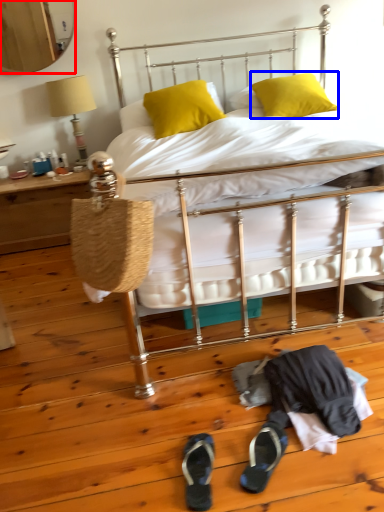
Question: Which object appears farthest to the camera in this image, mirror (highlighted by a red box) or pillow (highlighted by a blue box)?

Choices:
 (A) mirror
 (B) pillow

Answer: (A)